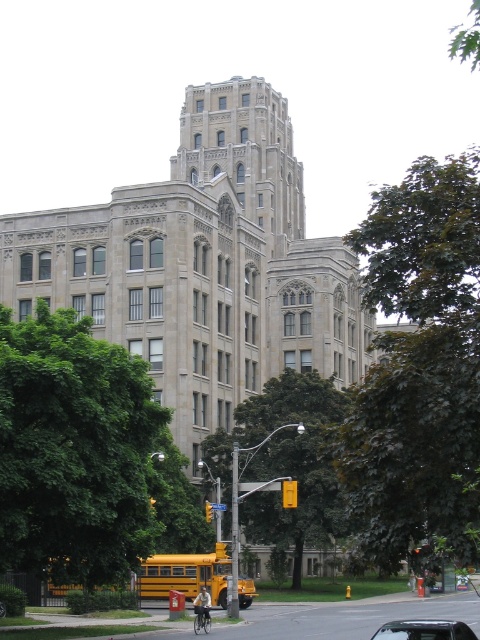
Question: Which point is farther from the camera taking this photo?

Choices:
 (A) (386, 372)
 (B) (292, 529)

Answer: (B)

Question: Is yellow matte school bus at lower center below metallic silver car at center?

Choices:
 (A) yes
 (B) no

Answer: (A)

Question: Does green leafy tree at left have a smaller size compared to green leafy tree at center?

Choices:
 (A) yes
 (B) no

Answer: (A)

Question: Considering the real-world distances, which object is closest to the yellow matte school bus at lower center?

Choices:
 (A) metallic silver car at center
 (B) green leafy tree at center
 (C) green leafy tree at left

Answer: (C)

Question: Which object is positioned farthest from the dark green leafy tree at center?

Choices:
 (A) green leafy tree at left
 (B) yellow matte school bus at lower center
 (C) green leafy tree at center

Answer: (A)

Question: Is green leafy tree at left thinner than green leafy tree at center?

Choices:
 (A) yes
 (B) no

Answer: (A)